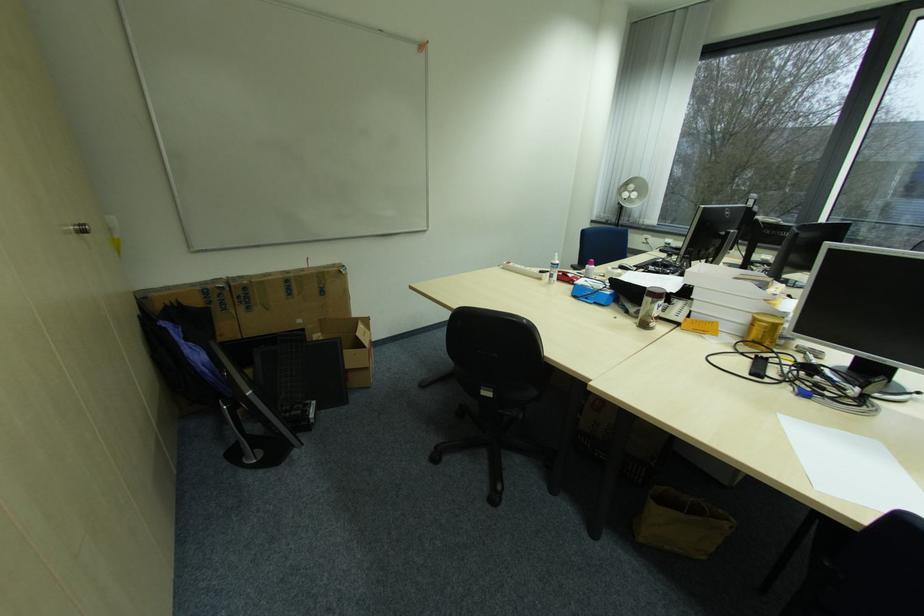
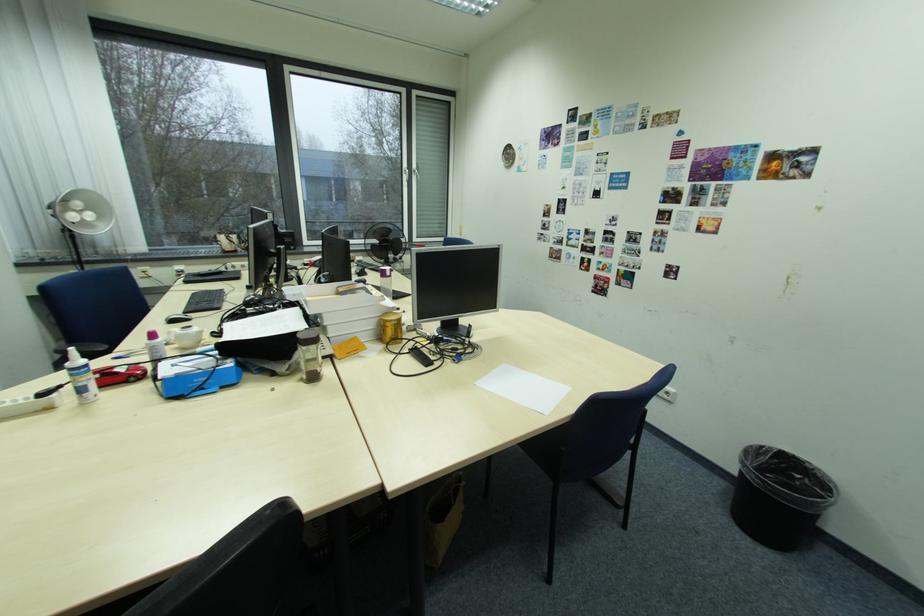
Locate, in the second image, the point that corresponds to point (764, 342) in the first image.

(400, 339)